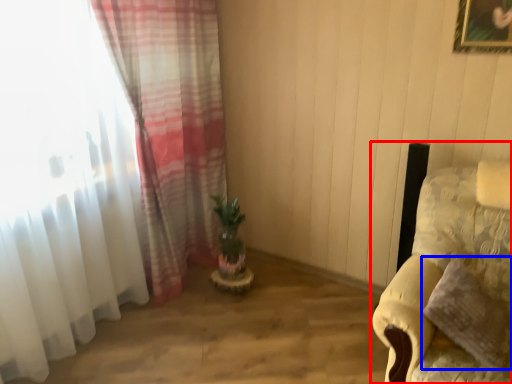
Question: Which object appears closest to the camera in this image, furniture (highlighted by a red box) or pillow (highlighted by a blue box)?

Choices:
 (A) furniture
 (B) pillow

Answer: (A)